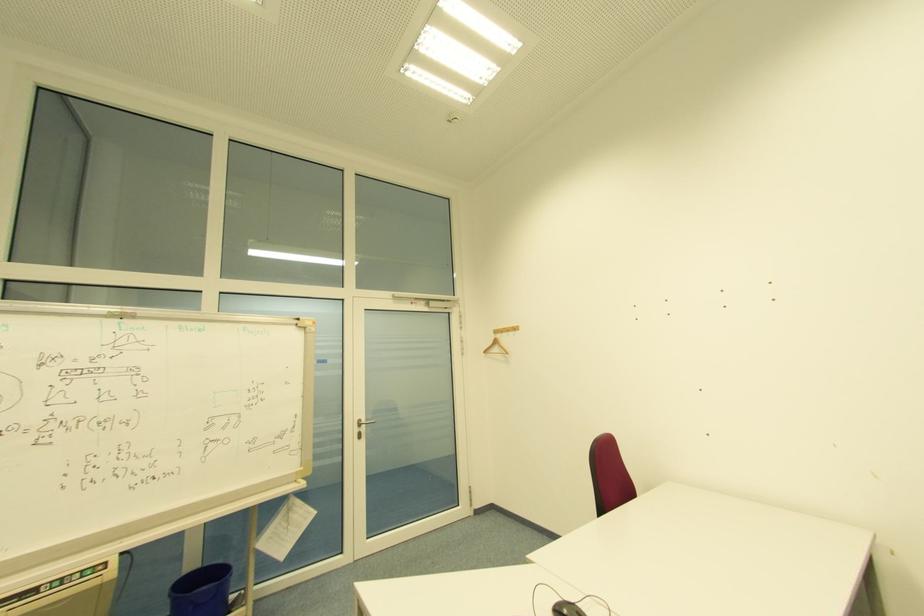
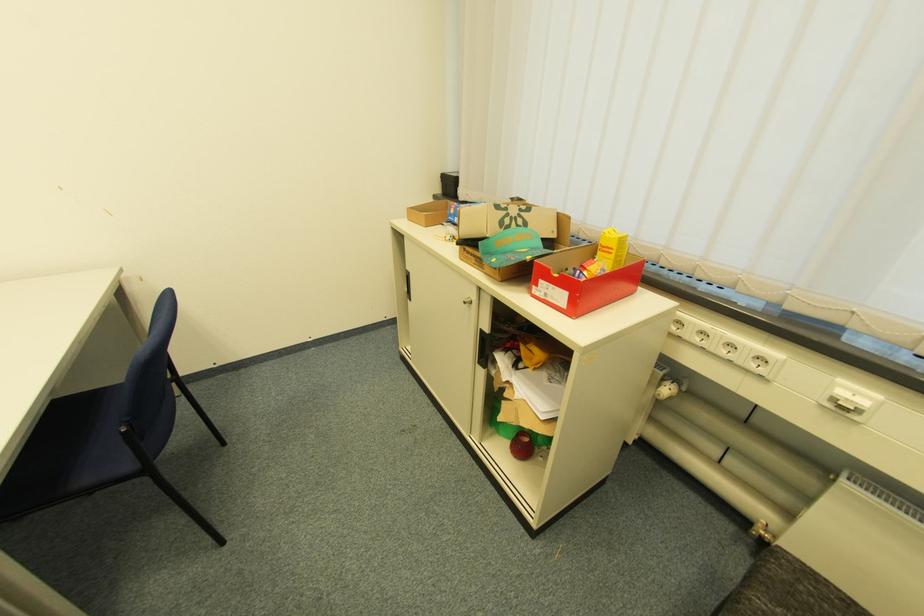
First-person continuous shooting, in which direction is the camera rotating?

The camera rotated toward right-down.